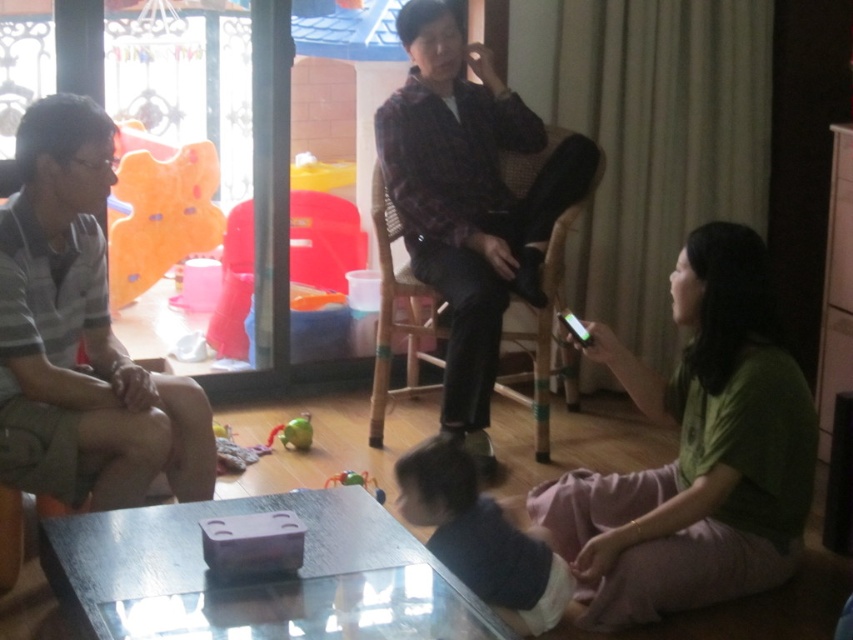
You are standing in the living area and see the point at coordinates (x=80, y=336). What object or part of an object is located at that point?

The point at coordinates (x=80, y=336) is located on the striped cotton shirt at left.

You are a child who wants to play with both the soft plush bear at upper left and the green rubber toy at center. Which toy should you pick up first if you want to start with the bigger one?

The soft plush bear at upper left is larger in size compared to the green rubber toy at center, so you should pick up the soft plush bear at upper left first.

You are a photographer standing in the living area and want to take a closeup shot of the striped cotton shirt at left. The camera you are using has a minimum focusing distance of 1.8 meters. Will you be able to take the photo without moving closer?

The distance between the striped cotton shirt at left and the camera is 2.10 meters. Since the minimum focusing distance is 1.8 meters, you can take the photo without moving closer because the current distance is greater than the required minimum.